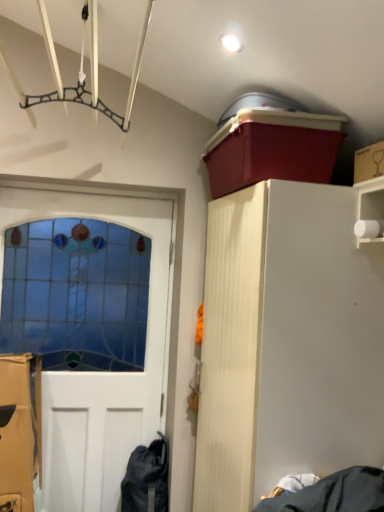
Question: From a real-world perspective, is matte plastic storage bin at upper right beneath stained glass door at left?

Choices:
 (A) no
 (B) yes

Answer: (A)

Question: Does matte plastic storage bin at upper right have a lesser height compared to stained glass door at left?

Choices:
 (A) yes
 (B) no

Answer: (A)

Question: Can you confirm if matte plastic storage bin at upper right is positioned to the left of stained glass door at left?

Choices:
 (A) yes
 (B) no

Answer: (B)

Question: Considering the relative sizes of matte plastic storage bin at upper right and stained glass door at left in the image provided, is matte plastic storage bin at upper right taller than stained glass door at left?

Choices:
 (A) no
 (B) yes

Answer: (A)

Question: Is matte plastic storage bin at upper right beside stained glass door at left?

Choices:
 (A) no
 (B) yes

Answer: (A)

Question: From their relative heights in the image, would you say cardboard box at upper right is taller or shorter than white wood cabinet at upper right?

Choices:
 (A) short
 (B) tall

Answer: (A)

Question: In the image, is cardboard box at upper right on the left side or the right side of white wood cabinet at upper right?

Choices:
 (A) right
 (B) left

Answer: (A)

Question: Looking at their shapes, would you say cardboard box at upper right is wider or thinner than white wood cabinet at upper right?

Choices:
 (A) wide
 (B) thin

Answer: (B)

Question: Considering the positions of point (374, 155) and point (337, 320), is point (374, 155) closer or farther from the camera than point (337, 320)?

Choices:
 (A) closer
 (B) farther

Answer: (A)

Question: Relative to cardboard box at upper right, is matte plastic storage bin at upper right in front or behind?

Choices:
 (A) front
 (B) behind

Answer: (B)

Question: In terms of size, does matte plastic storage bin at upper right appear bigger or smaller than cardboard box at upper right?

Choices:
 (A) big
 (B) small

Answer: (A)

Question: From a real-world perspective, is matte plastic storage bin at upper right positioned above or below cardboard box at upper right?

Choices:
 (A) below
 (B) above

Answer: (B)

Question: Considering the positions of point (238, 148) and point (357, 152), is point (238, 148) closer or farther from the camera than point (357, 152)?

Choices:
 (A) closer
 (B) farther

Answer: (B)

Question: Considering their positions, is white wood cabinet at upper right located in front of or behind cardboard box at upper right?

Choices:
 (A) front
 (B) behind

Answer: (B)

Question: Would you say white wood cabinet at upper right is to the left or to the right of cardboard box at upper right in the picture?

Choices:
 (A) right
 (B) left

Answer: (B)